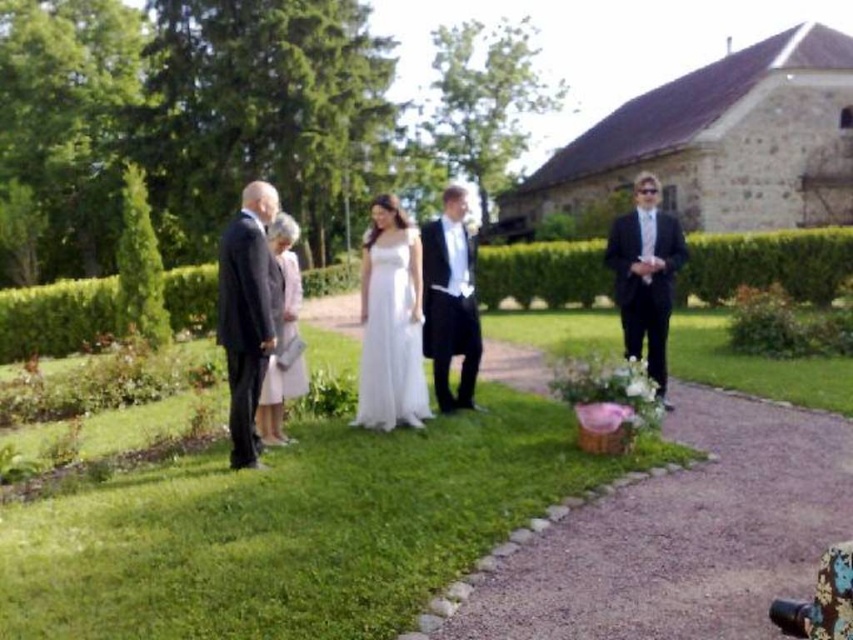
Who is more distant from viewer, (241, 563) or (277, 362)?

Positioned behind is point (277, 362).

Is green grass at center smaller than light pink satin dress at center?

Incorrect, green grass at center is not smaller in size than light pink satin dress at center.

Locate an element on the screen. green grass at center is located at coordinates (294, 529).

Identify the location of green grass at center. The height and width of the screenshot is (640, 853). (294, 529).

Who is higher up, green grass at center or dark gray suit at left?

dark gray suit at left

Does green grass at center lie in front of dark gray suit at left?

Yes, green grass at center is closer to the viewer.

The image size is (853, 640). Find the location of `green grass at center`. green grass at center is located at coordinates (294, 529).

This screenshot has width=853, height=640. Find the location of `green grass at center`. green grass at center is located at coordinates (294, 529).

Between point (663, 308) and point (280, 365), which one is positioned behind?

Positioned behind is point (663, 308).

You are a GUI agent. You are given a task and a screenshot of the screen. Output one action in this format:
    pyautogui.click(x=<x>, y=<y>)
    Task: Click on the matte black suit at right
    This screenshot has height=640, width=853.
    Given the screenshot: What is the action you would take?
    pyautogui.click(x=645, y=275)